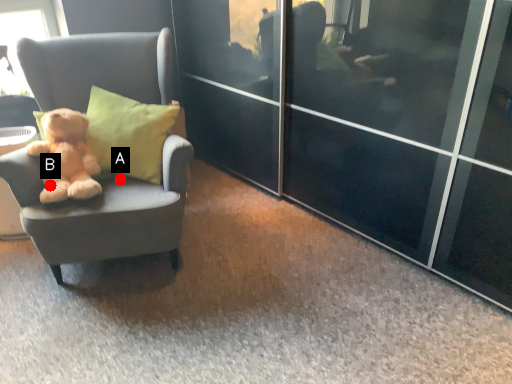
Question: Two points are circled on the image, labeled by A and B beside each circle. Which point is farther to the camera?

Choices:
 (A) A is further
 (B) B is further

Answer: (A)